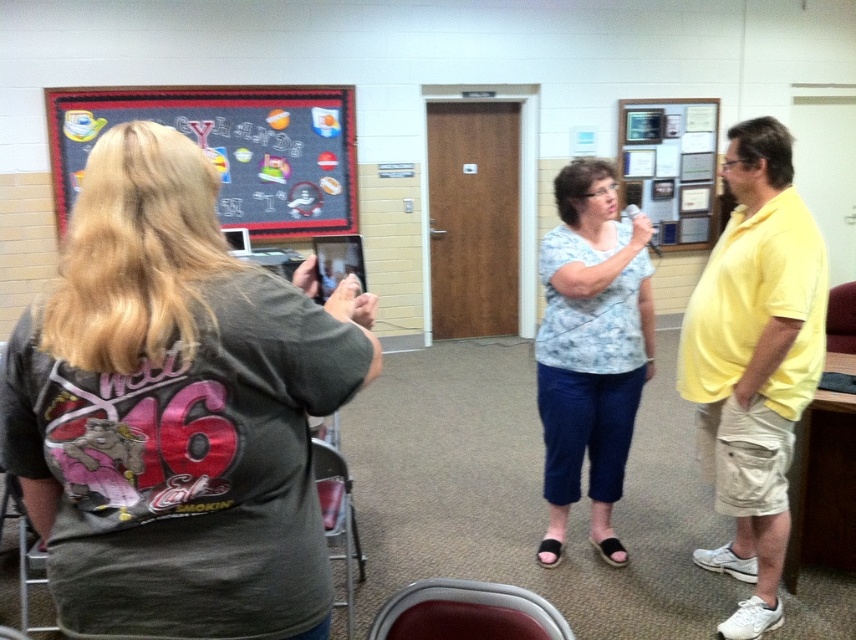
You are standing in the classroom and want to place a small plant between the two points labeled point (735, 198) and point (572, 474). Since the plant needs to be closer to the viewer, which point should you use as the base for placing the plant?

Point (735, 198) is closer to the viewer than point (572, 474), so you should place the plant near point (735, 198) to ensure it is closer to the viewer.

You are standing in the classroom and want to take a photo of the blackboard with stickers at upper left without anyone blocking it. Is the yellow cotton shirt at center currently in the way?

The yellow cotton shirt at center is in front of the blackboard with stickers at upper left, so it is blocking the view of the blackboard with stickers at upper left. Move the yellow cotton shirt at center out of the way to take an unobstructed photo.

You are standing in the classroom and want to hand out a note to both the person wearing the yellow cotton shirt at center and the light blue printed blouse at center. Which one should you approach first if you want to start with the person who is on the left side?

The light blue printed blouse at center is on the left side, so you should approach them first.